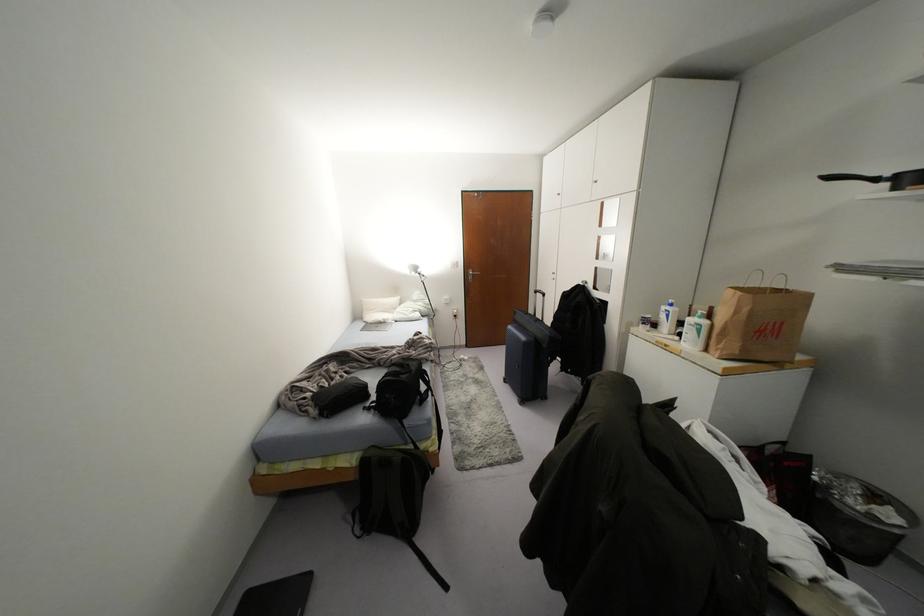
The image size is (924, 616). In order to click on black pan handle in this screenshot , I will do `click(852, 177)`.